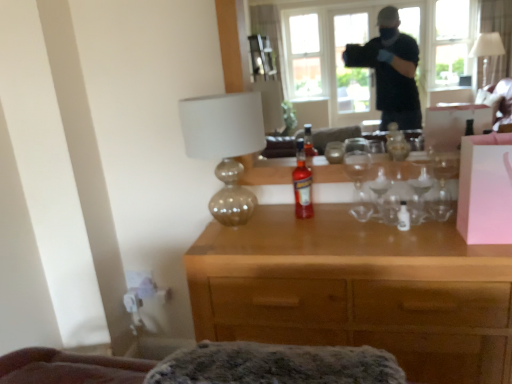
Where is `vacant space in front of translucent glass bottle at center`? The image size is (512, 384). vacant space in front of translucent glass bottle at center is located at coordinates [314, 236].